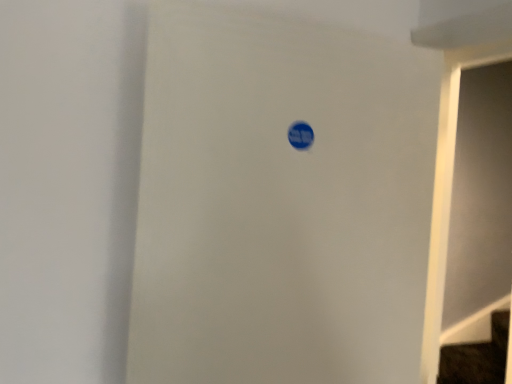
Where is `dark brown wooden stairs at lower right`? The image size is (512, 384). dark brown wooden stairs at lower right is located at coordinates (477, 357).

What do you see at coordinates (477, 357) in the screenshot?
I see `dark brown wooden stairs at lower right` at bounding box center [477, 357].

Locate an element on the screen. dark brown wooden stairs at lower right is located at coordinates (477, 357).